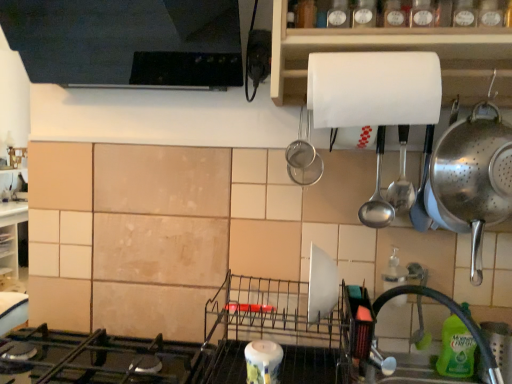
Question: From the image's perspective, is satin silver spoon at upper right located above white glossy candle at lower center, placed as the 1th appliance when sorted from bottom to top?

Choices:
 (A) yes
 (B) no

Answer: (A)

Question: Is satin silver spoon at upper right further to camera compared to white glossy candle at lower center, positioned as the second appliance in top-to-bottom order?

Choices:
 (A) no
 (B) yes

Answer: (B)

Question: From a real-world perspective, is satin silver spoon at upper right physically above white glossy candle at lower center, placed as the 1th appliance when sorted from bottom to top?

Choices:
 (A) no
 (B) yes

Answer: (B)

Question: Is satin silver spoon at upper right facing away from white glossy candle at lower center, the second appliance in the right-to-left sequence?

Choices:
 (A) yes
 (B) no

Answer: (B)

Question: Considering the relative positions of satin silver spoon at upper right and white glossy candle at lower center, the 1th appliance in the left-to-right sequence, in the image provided, is satin silver spoon at upper right to the right of white glossy candle at lower center, the 1th appliance in the left-to-right sequence, from the viewer's perspective?

Choices:
 (A) no
 (B) yes

Answer: (B)

Question: From a real-world perspective, is green translucent bottle at lower right above or below black rubber faucet at lower right?

Choices:
 (A) above
 (B) below

Answer: (B)

Question: Is point (455, 317) closer or farther from the camera than point (409, 289)?

Choices:
 (A) farther
 (B) closer

Answer: (A)

Question: From the image's perspective, relative to black rubber faucet at lower right, is green translucent bottle at lower right above or below?

Choices:
 (A) below
 (B) above

Answer: (A)

Question: Do you think green translucent bottle at lower right is within black rubber faucet at lower right, or outside of it?

Choices:
 (A) outside
 (B) inside

Answer: (B)

Question: Based on their positions, is black rubber faucet at lower right located to the left or right of green translucent bottle at lower right?

Choices:
 (A) left
 (B) right

Answer: (A)

Question: Would you say black rubber faucet at lower right is inside or outside green translucent bottle at lower right?

Choices:
 (A) outside
 (B) inside

Answer: (A)

Question: From the image's perspective, relative to green translucent bottle at lower right, is black rubber faucet at lower right above or below?

Choices:
 (A) above
 (B) below

Answer: (A)

Question: In terms of height, does black rubber faucet at lower right look taller or shorter compared to green translucent bottle at lower right?

Choices:
 (A) short
 (B) tall

Answer: (B)

Question: Based on their positions, is white matte paper towel holder at upper center located to the left or right of black rubber faucet at lower right?

Choices:
 (A) right
 (B) left

Answer: (B)

Question: From a real-world perspective, is white matte paper towel holder at upper center physically located above or below black rubber faucet at lower right?

Choices:
 (A) above
 (B) below

Answer: (A)